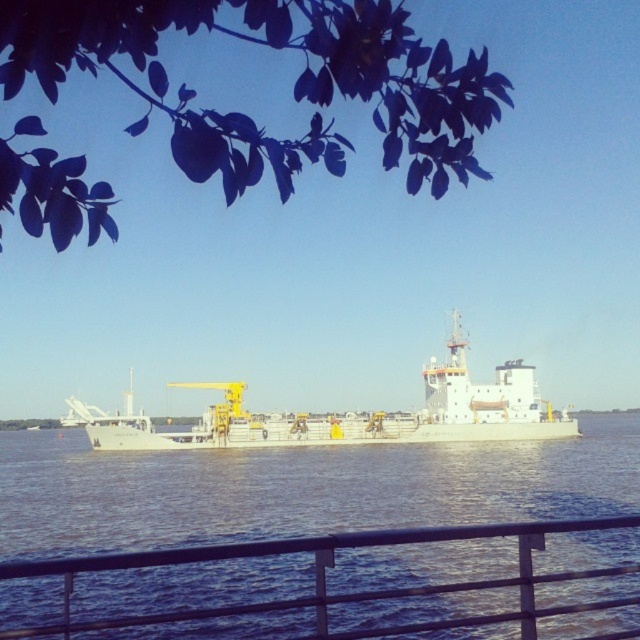
You are an observer standing on a dock and looking at the dark green leaves at upper left and the white matte ship at center. Which object is wider?

The dark green leaves at upper left has a lesser width compared to white matte ship at center, so the white matte ship at center is wider.

You are standing on a dock and looking at the dark green leaves at upper left and the white matte ship at center. Which object is higher in the image?

The dark green leaves at upper left is above the white matte ship at center in the image.